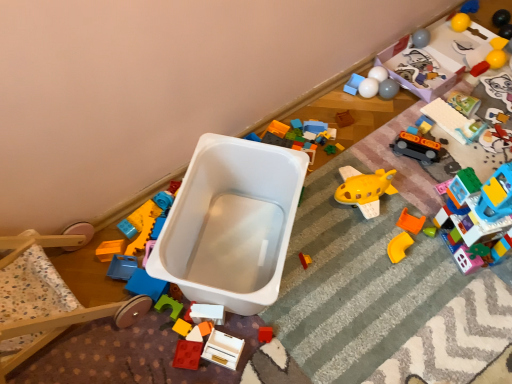
Question: Relative to rubberized plastic toy car at upper right, marked as the 4th toy in a right-to-left arrangement, is rubberized plastic block at center, the sixteenth toy from the right, in front or behind?

Choices:
 (A) behind
 (B) front

Answer: (B)

Question: Is rubberized plastic block at center, the 1th toy positioned from the left, to the left or to the right of rubberized plastic toy car at upper right, marked as the 4th toy in a right-to-left arrangement, in the image?

Choices:
 (A) right
 (B) left

Answer: (B)

Question: Considering the real-world distances, which object is farthest from the yellow rubber ball at upper right, which ranks as the fourteenth toy in left-to-right order?

Choices:
 (A) white glossy balls at upper right, the ninth toy positioned from the left
 (B) matte gray cat at upper right, acting as the 2th toy starting from the right
 (C) blue plastic toy at upper right, acting as the 1th toy starting from the right
 (D) orange matte plastic corner piece at lower right, the eighth toy positioned from the left
 (E) translucent plastic building blocks at right, arranged as the 5th toy when viewed from the right

Answer: (D)

Question: Based on their relative distances, which object is farther from the white plastic baby carriage at center?

Choices:
 (A) rubberized plastic block at center, the sixteenth toy from the right
 (B) translucent plastic building blocks at right, positioned as the 12th toy in left-to-right order
 (C) blue plastic toy at upper right, acting as the 1th toy starting from the right
 (D) orange matte plastic corner piece at lower right, the eighth toy positioned from the left
 (E) wooden bunk bed at left

Answer: (C)